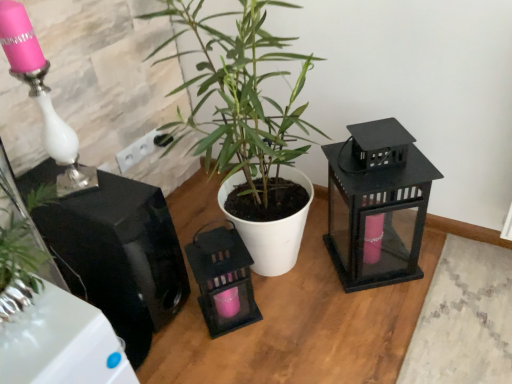
You are a GUI agent. You are given a task and a screenshot of the screen. Output one action in this format:
    pyautogui.click(x=<x>, y=<y>)
    Task: Click on the free space between matte black lantern at right, acting as the 2th appliance starting from the left, and green matte plant at center
    The width and height of the screenshot is (512, 384).
    Given the screenshot: What is the action you would take?
    pyautogui.click(x=325, y=288)